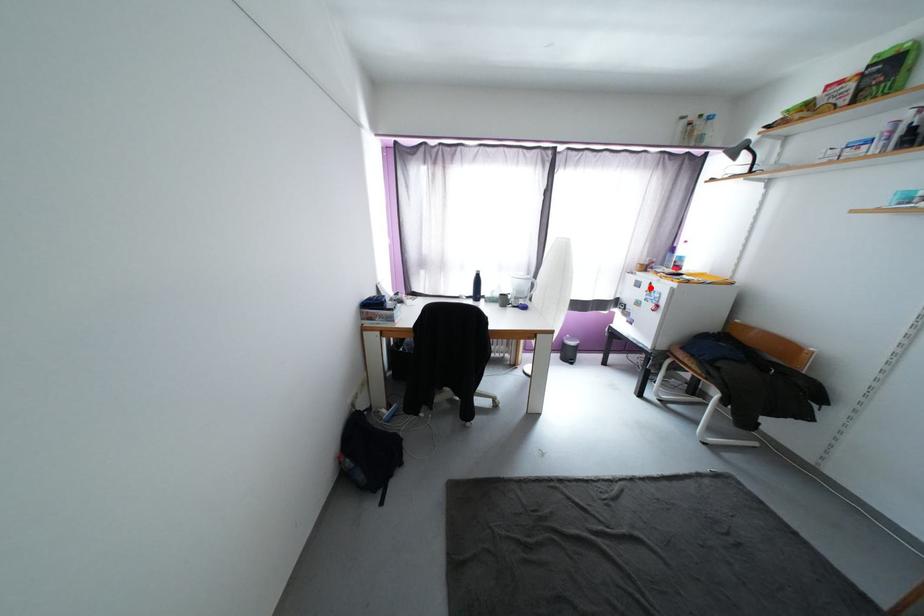
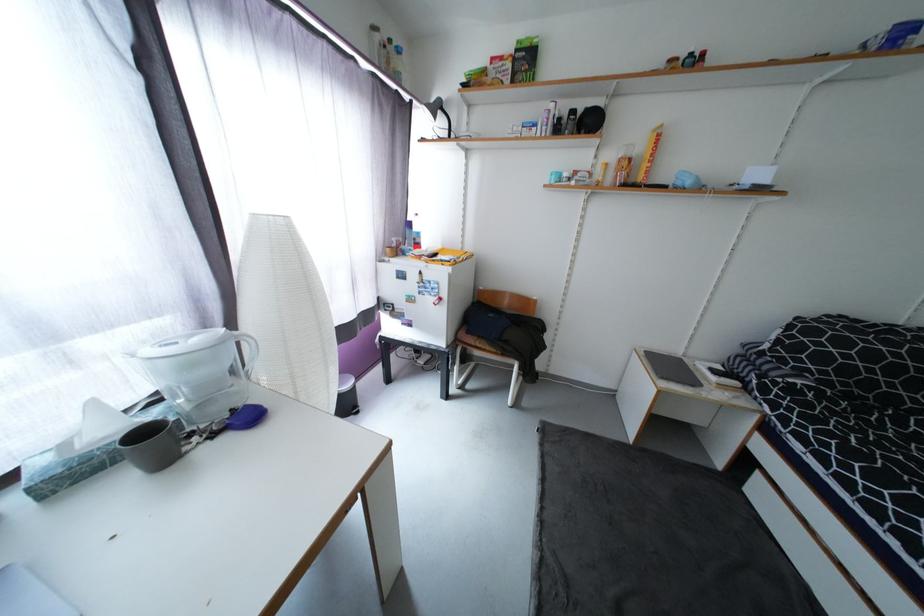
Question: I am providing you with two images of the same scene from different viewpoints. A red point is shown in image1. For the corresponding object point in image2, is it positioned nearer or farther from the camera?

Choices:
 (A) Nearer
 (B) Farther

Answer: (B)